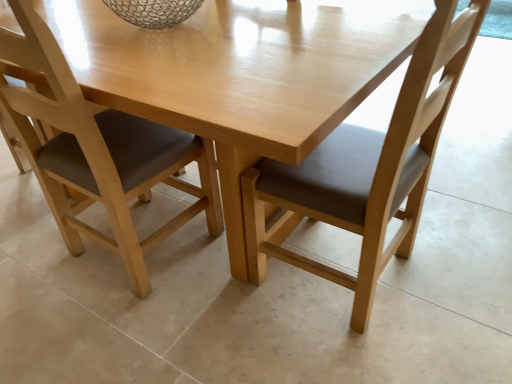
Question: Can you confirm if matte wood chair at center, the second chair positioned from the left, is smaller than matte wood chair at lower left, positioned as the 2th chair in right-to-left order?

Choices:
 (A) yes
 (B) no

Answer: (B)

Question: Is matte wood chair at center, the 1th chair from the right, positioned before matte wood chair at lower left, the first chair from the left?

Choices:
 (A) yes
 (B) no

Answer: (A)

Question: From a real-world perspective, is matte wood chair at center, the second chair positioned from the left, under matte wood chair at lower left, positioned as the 2th chair in right-to-left order?

Choices:
 (A) yes
 (B) no

Answer: (B)

Question: Is matte wood chair at center, the 1th chair from the right, facing away from matte wood chair at lower left, positioned as the 2th chair in right-to-left order?

Choices:
 (A) no
 (B) yes

Answer: (A)

Question: From a real-world perspective, is matte wood chair at center, the second chair positioned from the left, over matte wood chair at lower left, positioned as the 2th chair in right-to-left order?

Choices:
 (A) yes
 (B) no

Answer: (A)

Question: In terms of width, does matte wood chair at lower left, positioned as the 2th chair in right-to-left order, look wider or thinner when compared to light wood table at center?

Choices:
 (A) wide
 (B) thin

Answer: (B)

Question: From the image's perspective, is matte wood chair at lower left, positioned as the 2th chair in right-to-left order, above or below light wood table at center?

Choices:
 (A) above
 (B) below

Answer: (B)

Question: Is matte wood chair at lower left, the first chair from the left, to the left or to the right of light wood table at center in the image?

Choices:
 (A) right
 (B) left

Answer: (B)

Question: Does point (56, 61) appear closer or farther from the camera than point (234, 69)?

Choices:
 (A) closer
 (B) farther

Answer: (A)

Question: In terms of height, does matte wood chair at center, the second chair positioned from the left, look taller or shorter compared to light wood table at center?

Choices:
 (A) short
 (B) tall

Answer: (B)

Question: Visually, is matte wood chair at center, the second chair positioned from the left, positioned to the left or to the right of light wood table at center?

Choices:
 (A) left
 (B) right

Answer: (B)

Question: In the image, is matte wood chair at center, the second chair positioned from the left, positioned in front of or behind light wood table at center?

Choices:
 (A) behind
 (B) front

Answer: (B)

Question: Is matte wood chair at center, the second chair positioned from the left, situated inside light wood table at center or outside?

Choices:
 (A) outside
 (B) inside

Answer: (B)

Question: Considering the positions of light wood table at center and matte wood chair at center, the 1th chair from the right, in the image, is light wood table at center bigger or smaller than matte wood chair at center, the 1th chair from the right,?

Choices:
 (A) big
 (B) small

Answer: (A)

Question: Looking at their shapes, would you say light wood table at center is wider or thinner than matte wood chair at center, the 1th chair from the right?

Choices:
 (A) wide
 (B) thin

Answer: (A)